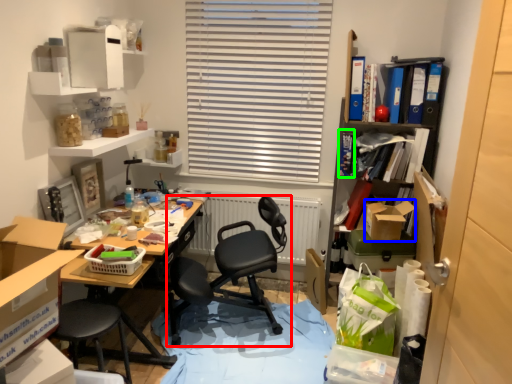
Question: Estimate the real-world distances between objects in this image. Which object is closer to chair (highlighted by a red box), box (highlighted by a blue box) or book (highlighted by a green box)?

Choices:
 (A) box
 (B) book

Answer: (A)